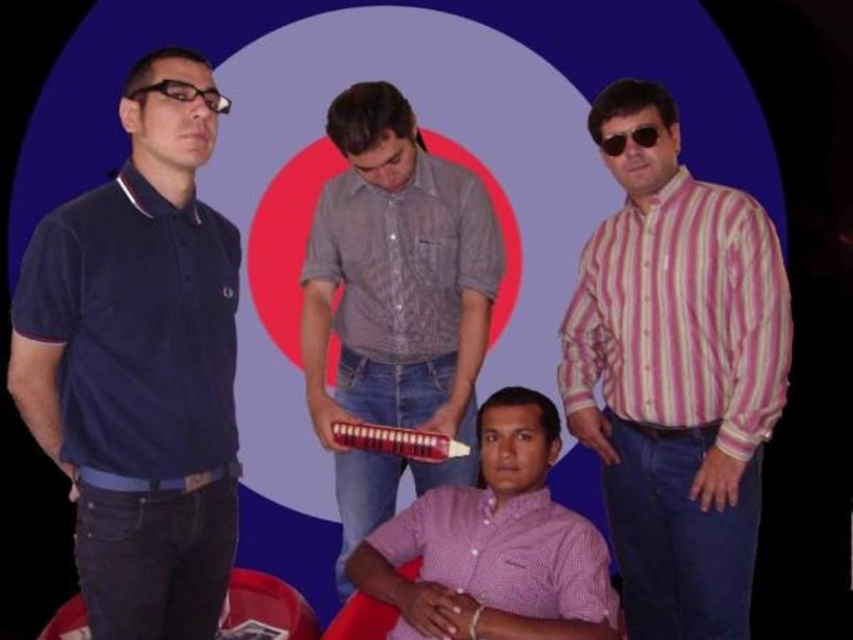
Question: Based on their relative distances, which object is farther from the navy blue polo shirt at left?

Choices:
 (A) textured gray shirt at center
 (B) pink checkered shirt at center
 (C) sunglasses at upper right
 (D) black plastic glasses at left

Answer: (C)

Question: Is navy blue polo shirt at left closer to camera compared to textured gray shirt at center?

Choices:
 (A) yes
 (B) no

Answer: (A)

Question: Estimate the real-world distances between objects in this image. Which object is closer to the pink striped shirt at right?

Choices:
 (A) navy blue polo shirt at left
 (B) black plastic glasses at left
 (C) pink checkered shirt at center
 (D) textured gray shirt at center

Answer: (C)

Question: Does textured gray shirt at center appear under sunglasses at upper right?

Choices:
 (A) yes
 (B) no

Answer: (A)

Question: Which point is farther to the camera?

Choices:
 (A) (476, 308)
 (B) (656, 129)

Answer: (A)

Question: Does black plastic glasses at left have a larger size compared to sunglasses at upper right?

Choices:
 (A) no
 (B) yes

Answer: (B)